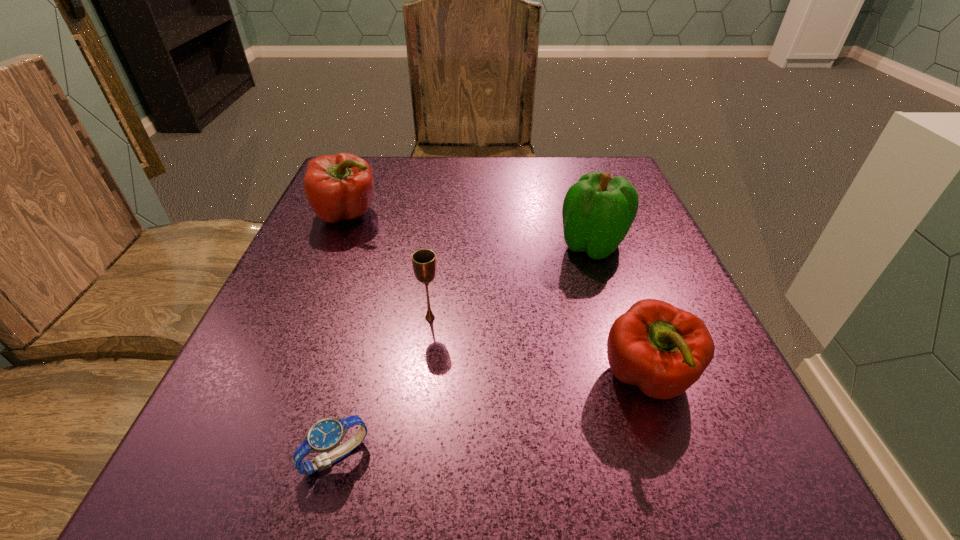
Image resolution: width=960 pixels, height=540 pixels. Find the location of `vacant space at the far left corner of the desktop`. vacant space at the far left corner of the desktop is located at coordinates (386, 177).

In the image, there is a desktop. Identify the location of free space at the near left corner. (262, 501).

The height and width of the screenshot is (540, 960). In order to click on blank area at the far right corner in this screenshot , I will do pos(604,167).

Image resolution: width=960 pixels, height=540 pixels. In the image, there is a desktop. Identify the location of blank space at the near right corner. (748, 455).

Image resolution: width=960 pixels, height=540 pixels. Identify the location of vacant area between the leftmost bell pepper and the third nearest object. (389, 266).

Where is `free space that is in between the nearest object and the chalice`? Image resolution: width=960 pixels, height=540 pixels. free space that is in between the nearest object and the chalice is located at coordinates (383, 387).

Find the location of a particular element. The width and height of the screenshot is (960, 540). free space between the leftmost bell pepper and the nearest bell pepper is located at coordinates (497, 297).

At what (x,y) coordinates should I click in order to perform the action: click on free area in between the nearest bell pepper and the shortest object. Please return your answer as a coordinate pair (x, y). The width and height of the screenshot is (960, 540). Looking at the image, I should click on (492, 418).

The height and width of the screenshot is (540, 960). What are the coordinates of `vacant space in between the nearest bell pepper and the leftmost bell pepper` in the screenshot? It's located at (497, 297).

Where is `unoccupied position between the chalice and the nearest bell pepper`? The image size is (960, 540). unoccupied position between the chalice and the nearest bell pepper is located at coordinates (539, 348).